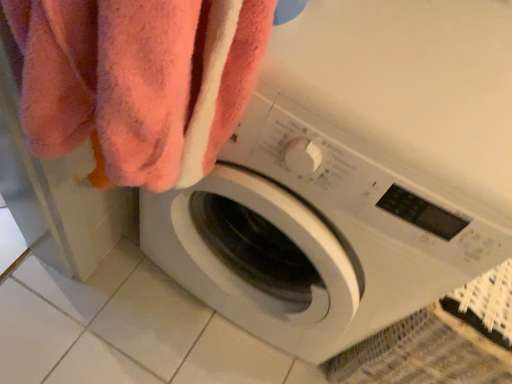
What do you see at coordinates (353, 175) in the screenshot? I see `white plastic washing machine at center` at bounding box center [353, 175].

Where is `white plastic washing machine at center`? white plastic washing machine at center is located at coordinates pos(353,175).

In order to face soft pink towel at upper left, should I rotate leftwards or rightwards?

Turn left by 14.896 degrees to look at soft pink towel at upper left.

This screenshot has width=512, height=384. What do you see at coordinates (138, 81) in the screenshot?
I see `soft pink towel at upper left` at bounding box center [138, 81].

At what (x,y) coordinates should I click in order to perform the action: click on soft pink towel at upper left. Please return your answer as a coordinate pair (x, y). This screenshot has height=384, width=512. Looking at the image, I should click on (138, 81).

Where is `white plastic washing machine at center`? This screenshot has width=512, height=384. white plastic washing machine at center is located at coordinates (353, 175).

Which is more to the right, soft pink towel at upper left or white plastic washing machine at center?

From the viewer's perspective, white plastic washing machine at center appears more on the right side.

Is the depth of soft pink towel at upper left less than that of white plastic washing machine at center?

No, the depth of soft pink towel at upper left is greater than that of white plastic washing machine at center.

Considering the points (41, 43) and (429, 278), which point is behind, point (41, 43) or point (429, 278)?

The point (429, 278) is farther.

From the image's perspective, relative to white plastic washing machine at center, is soft pink towel at upper left above or below?

soft pink towel at upper left is situated lower than white plastic washing machine at center in the image.

From a real-world perspective, is soft pink towel at upper left on white plastic washing machine at center?

Yes.

Which of these two, soft pink towel at upper left or white plastic washing machine at center, is thinner?

Thinner between the two is soft pink towel at upper left.

Which of these two, soft pink towel at upper left or white plastic washing machine at center, stands shorter?

soft pink towel at upper left.

Which of these two, soft pink towel at upper left or white plastic washing machine at center, is bigger?

white plastic washing machine at center is bigger.

Does soft pink towel at upper left contain white plastic washing machine at center?

No, white plastic washing machine at center is not inside soft pink towel at upper left.

Can you see soft pink towel at upper left touching white plastic washing machine at center?

No, soft pink towel at upper left is not making contact with white plastic washing machine at center.

Is white plastic washing machine at center at the back of soft pink towel at upper left?

Yes.

What's the angular difference between soft pink towel at upper left and white plastic washing machine at center's facing directions?

soft pink towel at upper left and white plastic washing machine at center are facing 89.3 degrees away from each other.

Image resolution: width=512 pixels, height=384 pixels. Identify the location of washing machine located in front of the soft pink towel at upper left. (353, 175).

Between white plastic washing machine at center and soft pink towel at upper left, which one appears on the left side from the viewer's perspective?

soft pink towel at upper left is more to the left.

Does white plastic washing machine at center come behind soft pink towel at upper left?

No, white plastic washing machine at center is closer to the viewer.

Does point (499, 73) lie behind point (222, 110)?

That is True.

Consider the image. From the image's perspective, is white plastic washing machine at center positioned above or below soft pink towel at upper left?

Clearly, from the image's perspective, white plastic washing machine at center is above soft pink towel at upper left.

From a real-world perspective, is white plastic washing machine at center on top of soft pink towel at upper left?

No.

In terms of width, does white plastic washing machine at center look wider or thinner when compared to soft pink towel at upper left?

white plastic washing machine at center is wider than soft pink towel at upper left.

Who is taller, white plastic washing machine at center or soft pink towel at upper left?

Standing taller between the two is white plastic washing machine at center.

Which of these two, white plastic washing machine at center or soft pink towel at upper left, is bigger?

white plastic washing machine at center is bigger.

Based on the photo, is white plastic washing machine at center located outside soft pink towel at upper left?

white plastic washing machine at center lies outside soft pink towel at upper left's area.

Is the surface of white plastic washing machine at center in direct contact with soft pink towel at upper left?

white plastic washing machine at center is not next to soft pink towel at upper left, and they're not touching.

Is white plastic washing machine at center facing towards soft pink towel at upper left?

Yes, white plastic washing machine at center is turned towards soft pink towel at upper left.

How much distance is there between white plastic washing machine at center and soft pink towel at upper left?

21.31 centimeters.

Identify the location of washing machine to the right of soft pink towel at upper left. The image size is (512, 384). (353, 175).

Identify the location of towel behind the white plastic washing machine at center. The image size is (512, 384). (138, 81).

I want to click on towel above the white plastic washing machine at center (from a real-world perspective), so click(138, 81).